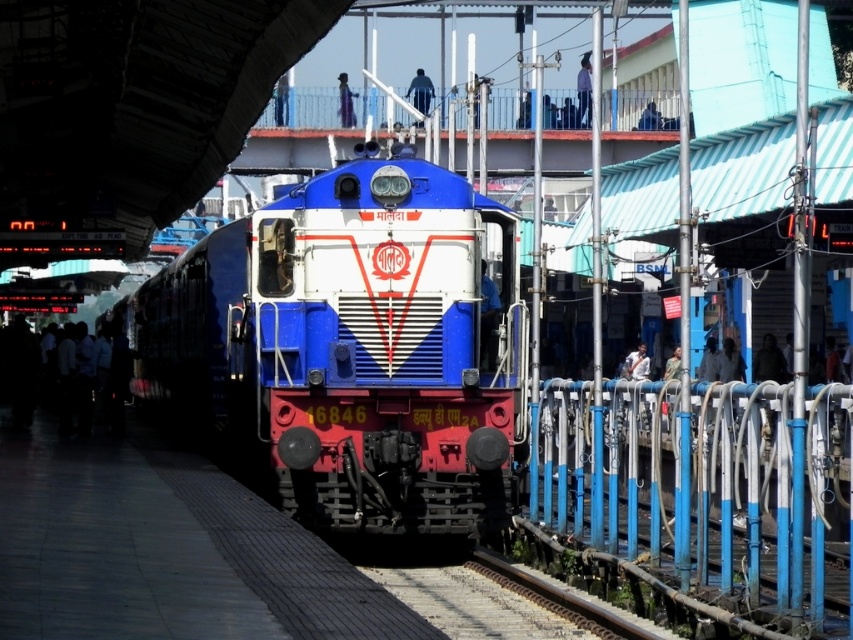
Question: Where is dark blue uniform at upper center located in relation to matte black person at upper center in the image?

Choices:
 (A) above
 (B) below

Answer: (A)

Question: Estimate the real-world distances between objects in this image. Which object is farther from the metallic pole at right?

Choices:
 (A) blue painted metal pole at right
 (B) light blue shirt at upper center
 (C) dark brown hair at center
 (D) white fabric shirt at center

Answer: (B)

Question: Can you confirm if blue metallic rail at right is smaller than camouflage fabric shirt at right?

Choices:
 (A) no
 (B) yes

Answer: (B)

Question: Considering the real-world distances, which object is closest to the light skin/white shirt at lower left?

Choices:
 (A) white fabric shirt at center
 (B) blue painted metal pole at right
 (C) camouflage fabric shirt at right
 (D) light blue shirt at upper center

Answer: (B)

Question: Which point is farther to the camera?

Choices:
 (A) black matte jacket at center
 (B) dark blue uniform at upper center
 (C) dark brown hair at center
 (D) camouflage fabric shirt at right

Answer: (B)

Question: Can you confirm if blue metallic rail at right is positioned below light blue shirt at upper center?

Choices:
 (A) no
 (B) yes

Answer: (B)